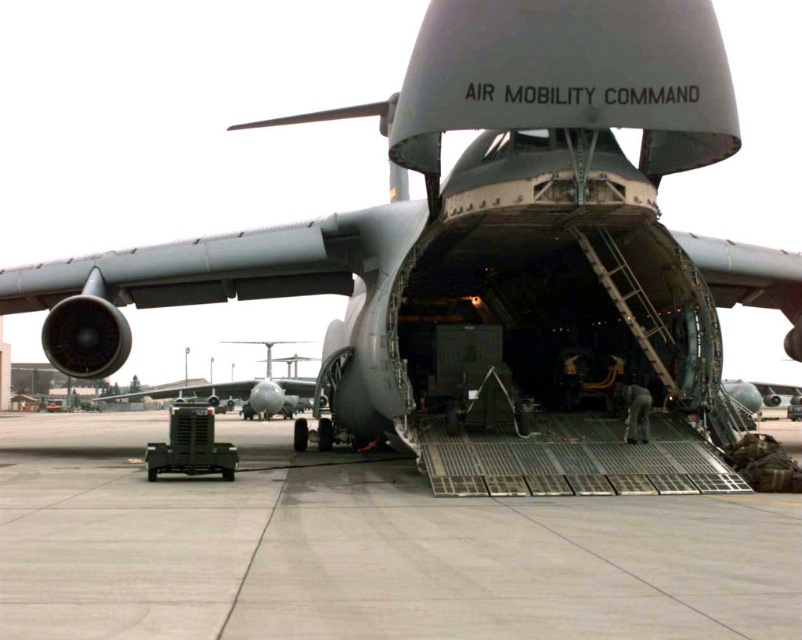
You are a maintenance worker on the tarmac and need to move a heavy equipment from the gray concrete tarmac at center to the metallic gray aircraft at center. Which object has a larger area to place the equipment?

The metallic gray aircraft at center has a larger area than the gray concrete tarmac at center, so the equipment should be placed on the metallic gray aircraft at center.

You are a maintenance worker needing to park a small van next to the gray concrete tarmac at center and the metallic gray aircraft at center. Which area has enough space to accommodate the van?

The metallic gray aircraft at center has a greater width than the gray concrete tarmac at center, so the van would fit better near the metallic gray aircraft at center.

You need to park a car that is 5 meters long in the space between the gray concrete tarmac at center and the metallic gray aircraft at center. Is there enough space?

The gray concrete tarmac at center is 24.02 meters from the metallic gray aircraft at center, so yes, there is enough space to park a car that is 5 meters long between them.